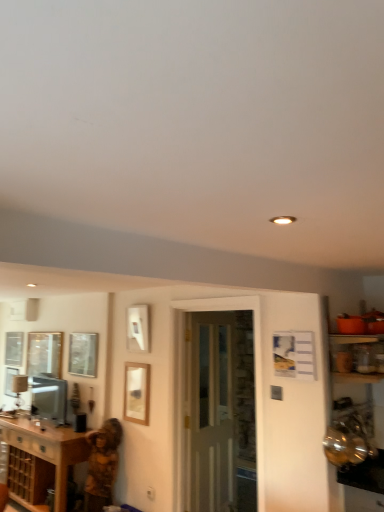
Question: Is clear glass door at center thinner than wooden picture frame at center?

Choices:
 (A) no
 (B) yes

Answer: (A)

Question: From a real-world perspective, does clear glass door at center sit lower than wooden picture frame at center?

Choices:
 (A) yes
 (B) no

Answer: (A)

Question: Does clear glass door at center appear on the right side of wooden picture frame at center?

Choices:
 (A) no
 (B) yes

Answer: (B)

Question: Is clear glass door at center bigger than wooden picture frame at center?

Choices:
 (A) no
 (B) yes

Answer: (B)

Question: Considering the relative sizes of clear glass door at center and wooden picture frame at center in the image provided, is clear glass door at center wider than wooden picture frame at center?

Choices:
 (A) no
 (B) yes

Answer: (B)

Question: Would you say clear glass window at upper center, which is the first window in front-to-back order, is to the left or to the right of orange plastic bowls at right in the picture?

Choices:
 (A) left
 (B) right

Answer: (A)

Question: From a real-world perspective, is clear glass window at upper center, the 2th window viewed from the left, above or below orange plastic bowls at right?

Choices:
 (A) above
 (B) below

Answer: (A)

Question: Looking at their shapes, would you say clear glass window at upper center, which ranks as the 1th window in right-to-left order, is wider or thinner than orange plastic bowls at right?

Choices:
 (A) wide
 (B) thin

Answer: (B)

Question: From the image's perspective, is clear glass window at upper center, which is the first window in front-to-back order, located above or below orange plastic bowls at right?

Choices:
 (A) below
 (B) above

Answer: (A)

Question: From the image's perspective, is orange plastic bowls at right above or below matte silver television at lower left?

Choices:
 (A) below
 (B) above

Answer: (B)

Question: Is orange plastic bowls at right to the left or to the right of matte silver television at lower left in the image?

Choices:
 (A) left
 (B) right

Answer: (B)

Question: From their relative heights in the image, would you say orange plastic bowls at right is taller or shorter than matte silver television at lower left?

Choices:
 (A) tall
 (B) short

Answer: (A)

Question: Is orange plastic bowls at right in front of or behind matte silver television at lower left in the image?

Choices:
 (A) behind
 (B) front

Answer: (B)

Question: From the image's perspective, relative to brown wood cabinet at lower left, is wooden picture frame at center above or below?

Choices:
 (A) below
 (B) above

Answer: (B)

Question: From a real-world perspective, is wooden picture frame at center above or below brown wood cabinet at lower left?

Choices:
 (A) below
 (B) above

Answer: (B)